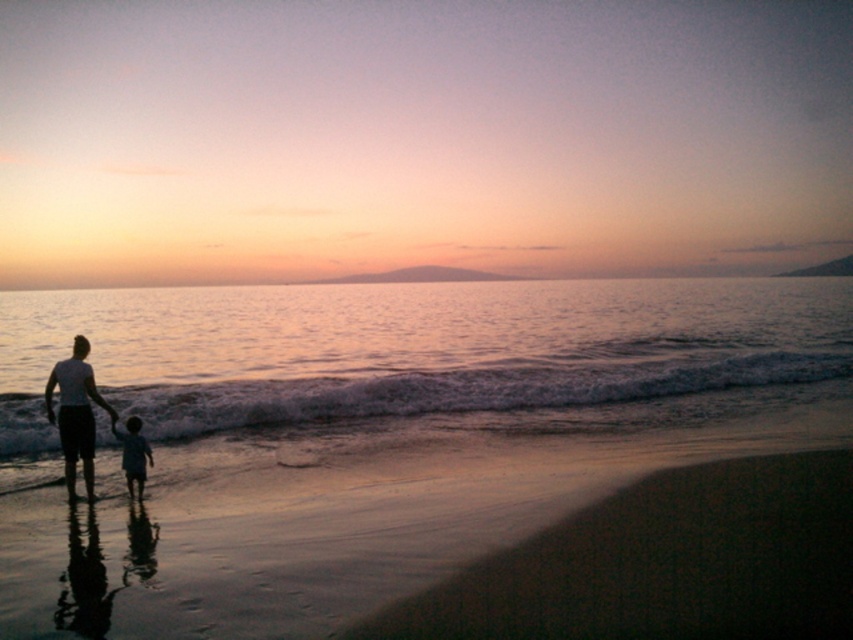
Question: Considering the relative positions of sandy beach at lower left and smooth skin child at lower left in the image provided, where is sandy beach at lower left located with respect to smooth skin child at lower left?

Choices:
 (A) left
 (B) right

Answer: (B)

Question: Which object is closer to the camera taking this photo?

Choices:
 (A) sandy beach at lower left
 (B) smooth skin child at lower left
 (C) white matte shirt at left
 (D) shiny silver water at center

Answer: (A)

Question: Does sandy beach at lower left appear on the right side of white matte shirt at left?

Choices:
 (A) yes
 (B) no

Answer: (A)

Question: Which of the following is the farthest from the observer?

Choices:
 (A) shiny silver water at center
 (B) sandy beach at lower left

Answer: (A)

Question: Can you confirm if shiny silver water at center is wider than white matte shirt at left?

Choices:
 (A) no
 (B) yes

Answer: (B)

Question: Which point appears farthest from the camera in this image?

Choices:
 (A) (50, 412)
 (B) (241, 538)
 (C) (129, 474)

Answer: (A)